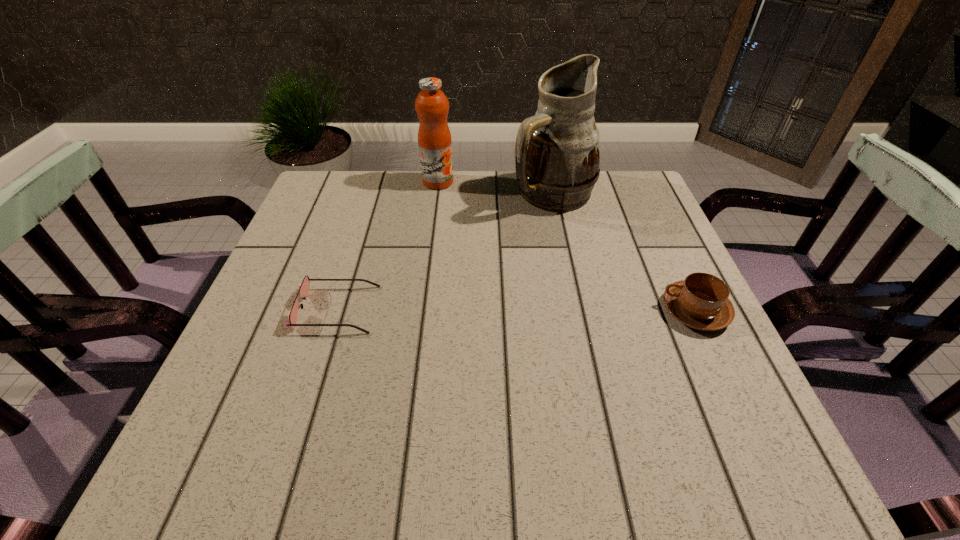
You are a GUI agent. You are given a task and a screenshot of the screen. Output one action in this format:
    pyautogui.click(x=<x>, y=<y>)
    Task: Click on the sunglasses
    The height and width of the screenshot is (540, 960).
    Given the screenshot: What is the action you would take?
    pyautogui.click(x=304, y=287)

The height and width of the screenshot is (540, 960). What are the coordinates of `the shortest object` in the screenshot? It's located at (304, 287).

The image size is (960, 540). Identify the location of the second shortest object. 701,301.

At what (x,y) coordinates should I click in order to perform the action: click on the rightmost object. Please return your answer as a coordinate pair (x, y). Looking at the image, I should click on (701, 301).

Image resolution: width=960 pixels, height=540 pixels. What are the coordinates of `the third shortest object` in the screenshot? It's located at (434, 137).

What are the coordinates of `the second object from left to right` in the screenshot? It's located at (434, 137).

This screenshot has height=540, width=960. I want to click on the second object from right to left, so click(x=557, y=156).

Find the location of `pitcher`. pitcher is located at coordinates (557, 156).

The height and width of the screenshot is (540, 960). Identify the location of free space located on the bridge of the sunglasses. (527, 309).

The height and width of the screenshot is (540, 960). I want to click on free location located on the side of the rightmost object with the handle, so click(x=530, y=310).